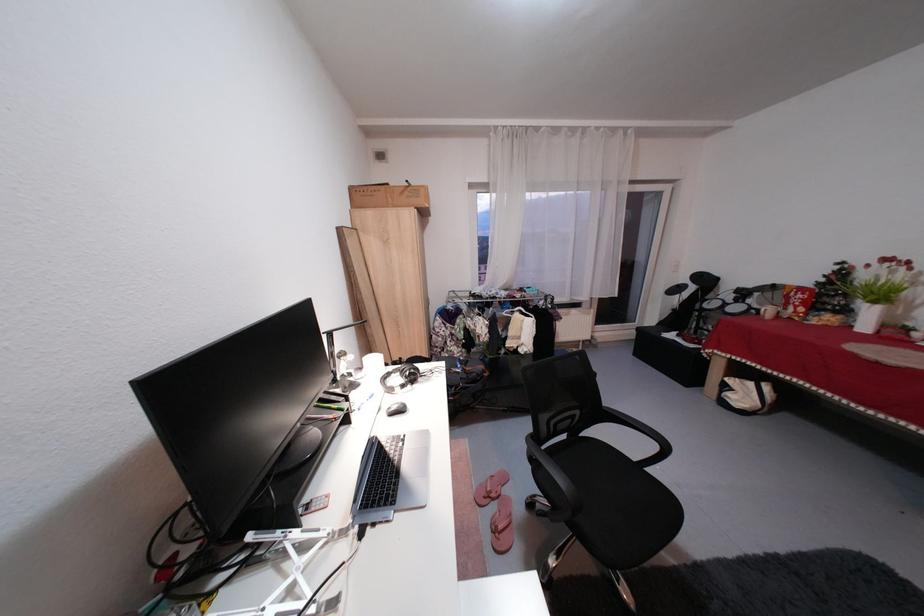
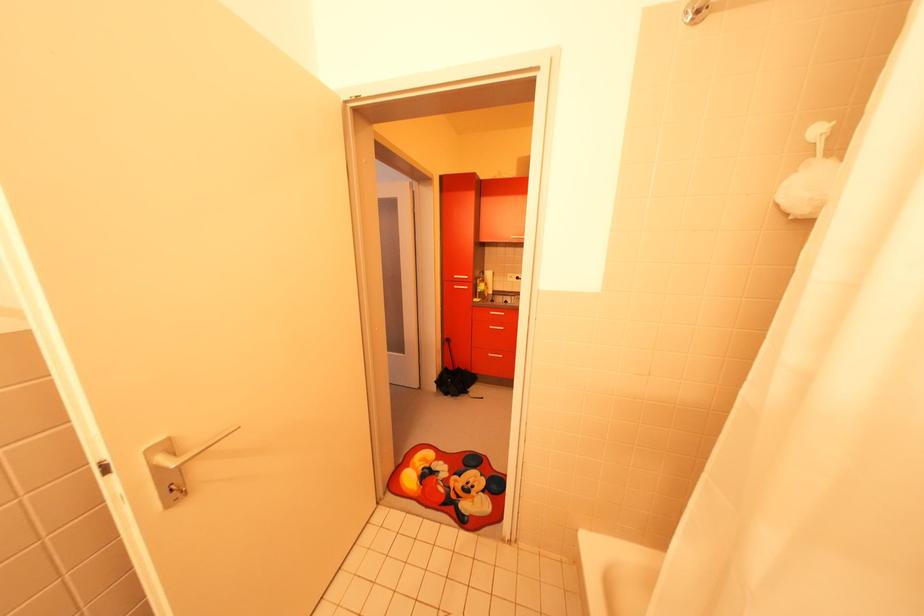
Question: I am providing you with two images of the same scene from different viewpoints. Which of the following objects are not visible in image2?

Choices:
 (A) chrome shower head
 (B) silver cabinet handle
 (C) metal can
 (D) black electronic drum pad

Answer: (D)